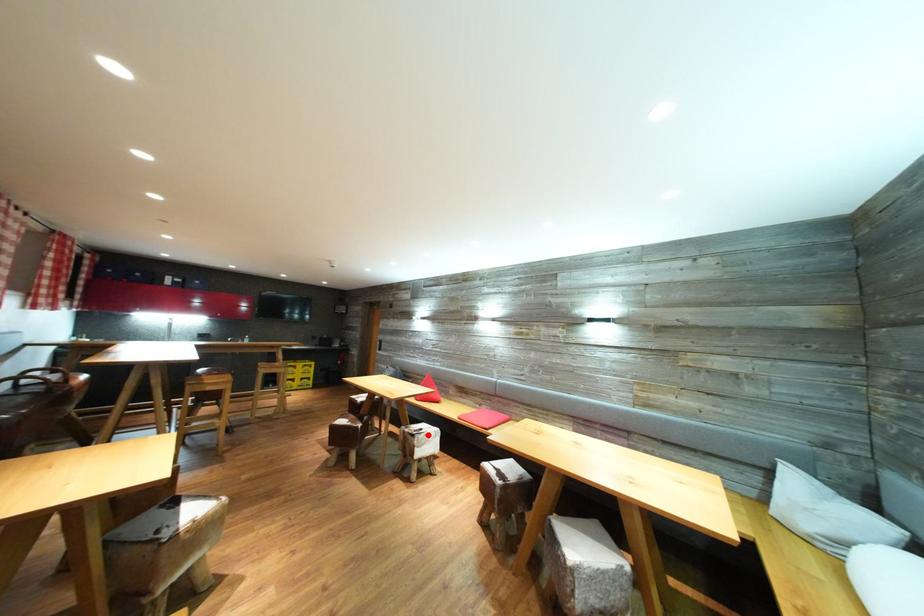
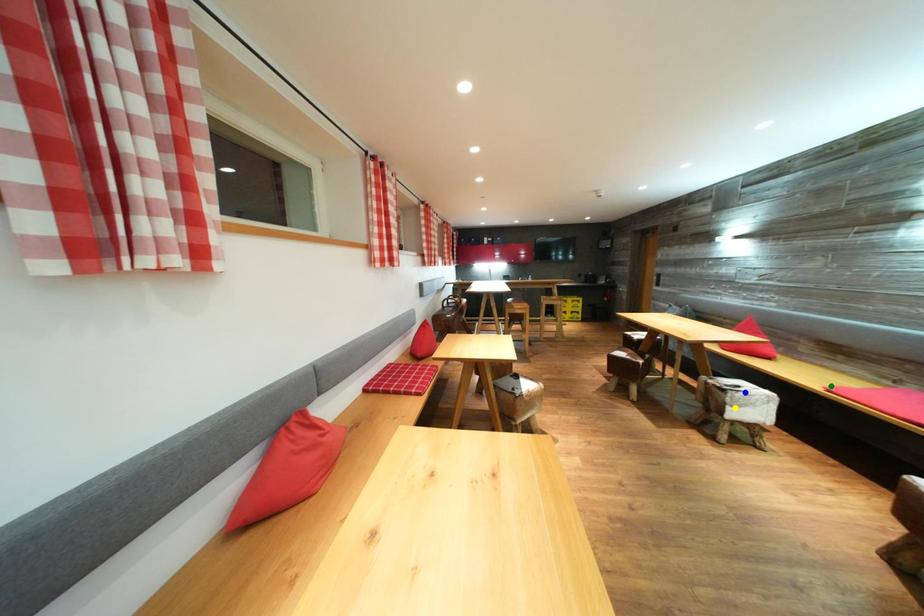
Question: I am providing you with two images of the same scene from different viewpoints. A red point is marked on the first image. You are given multiple points on the second image. Which mark in image 2 goes with the point in image 1?

Choices:
 (A) green point
 (B) blue point
 (C) yellow point

Answer: (B)